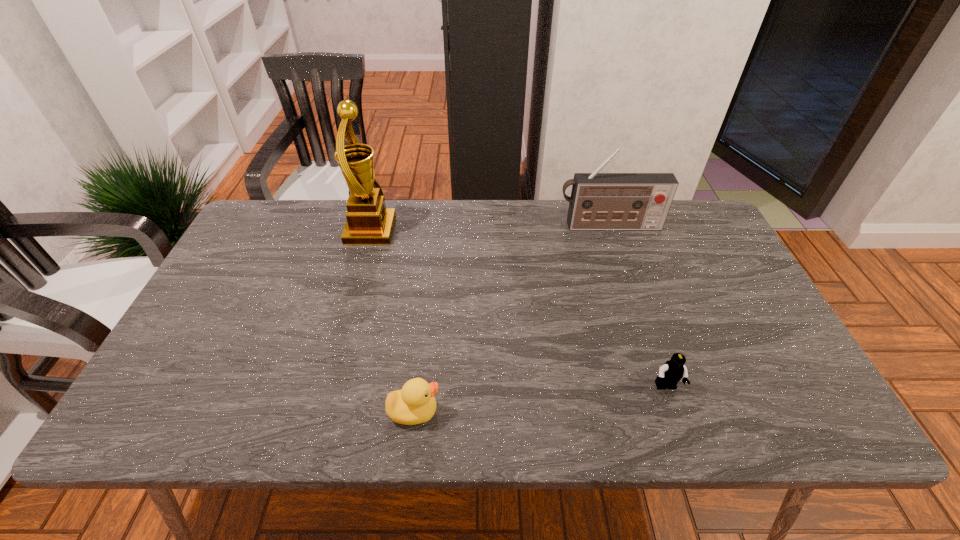
Find the location of `the second closest object to the Lego`. the second closest object to the Lego is located at coordinates (599, 201).

Image resolution: width=960 pixels, height=540 pixels. I want to click on free spot that satisfies the following two spatial constraints: 1. on the front-facing side of the Lego; 2. at the beak of the duck, so click(674, 411).

At what (x,y) coordinates should I click in order to perform the action: click on vacant area in the image that satisfies the following two spatial constraints: 1. on the front panel of the radio receiver; 2. at the beak of the second object from left to right. Please return your answer as a coordinate pair (x, y). The image size is (960, 540). Looking at the image, I should click on (670, 411).

The width and height of the screenshot is (960, 540). Find the location of `vacant space that satisfies the following two spatial constraints: 1. on the front-facing side of the Lego; 2. at the beak of the third object from right to left`. vacant space that satisfies the following two spatial constraints: 1. on the front-facing side of the Lego; 2. at the beak of the third object from right to left is located at coordinates (674, 411).

At what (x,y) coordinates should I click in order to perform the action: click on free space that satisfies the following two spatial constraints: 1. on the front panel of the third shortest object; 2. on the front-facing side of the award. Please return your answer as a coordinate pair (x, y). The image size is (960, 540). Looking at the image, I should click on (611, 231).